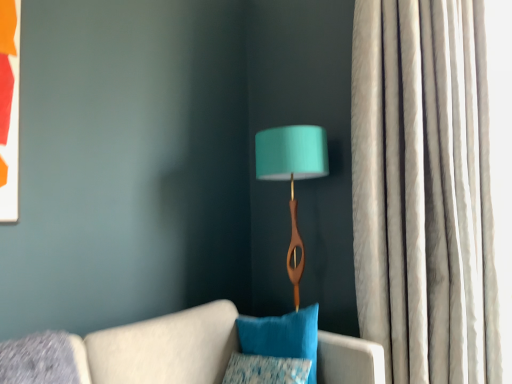
Question: Is silky white curtain at right shorter than velvety blue pillow at center, the 2th pillow positioned from the bottom?

Choices:
 (A) no
 (B) yes

Answer: (A)

Question: Is silky white curtain at right positioned beyond the bounds of velvety blue pillow at center, the 2th pillow positioned from the bottom?

Choices:
 (A) no
 (B) yes

Answer: (B)

Question: From the image's perspective, would you say silky white curtain at right is positioned over velvety blue pillow at center, the 2th pillow positioned from the bottom?

Choices:
 (A) yes
 (B) no

Answer: (A)

Question: From a real-world perspective, is silky white curtain at right beneath velvety blue pillow at center, the 2th pillow positioned from the bottom?

Choices:
 (A) no
 (B) yes

Answer: (A)

Question: Considering the relative sizes of silky white curtain at right and velvety blue pillow at center, placed as the 1th pillow when sorted from top to bottom, in the image provided, is silky white curtain at right smaller than velvety blue pillow at center, placed as the 1th pillow when sorted from top to bottom,?

Choices:
 (A) no
 (B) yes

Answer: (A)

Question: Considering the relative positions of silky white curtain at right and velvety blue pillow at center, placed as the 1th pillow when sorted from top to bottom, in the image provided, is silky white curtain at right to the left of velvety blue pillow at center, placed as the 1th pillow when sorted from top to bottom, from the viewer's perspective?

Choices:
 (A) no
 (B) yes

Answer: (A)

Question: Can you confirm if velvety blue pillow at center, placed as the 1th pillow when sorted from top to bottom, is positioned to the right of textured blue pillow at lower center, the second pillow from the top?

Choices:
 (A) no
 (B) yes

Answer: (B)

Question: Is velvety blue pillow at center, placed as the 1th pillow when sorted from top to bottom, aimed at textured blue pillow at lower center, placed as the first pillow when sorted from bottom to top?

Choices:
 (A) no
 (B) yes

Answer: (B)

Question: From the image's perspective, does velvety blue pillow at center, the 2th pillow positioned from the bottom, appear higher than textured blue pillow at lower center, the second pillow from the top?

Choices:
 (A) yes
 (B) no

Answer: (A)

Question: Does velvety blue pillow at center, placed as the 1th pillow when sorted from top to bottom, contain textured blue pillow at lower center, the second pillow from the top?

Choices:
 (A) yes
 (B) no

Answer: (A)

Question: From the image's perspective, is velvety blue pillow at center, placed as the 1th pillow when sorted from top to bottom, beneath textured blue pillow at lower center, placed as the first pillow when sorted from bottom to top?

Choices:
 (A) yes
 (B) no

Answer: (B)

Question: Can you confirm if velvety blue pillow at center, placed as the 1th pillow when sorted from top to bottom, is wider than textured blue pillow at lower center, the second pillow from the top?

Choices:
 (A) no
 (B) yes

Answer: (B)

Question: Is textured blue pillow at lower center, placed as the first pillow when sorted from bottom to top, in front of silky white curtain at right?

Choices:
 (A) yes
 (B) no

Answer: (A)